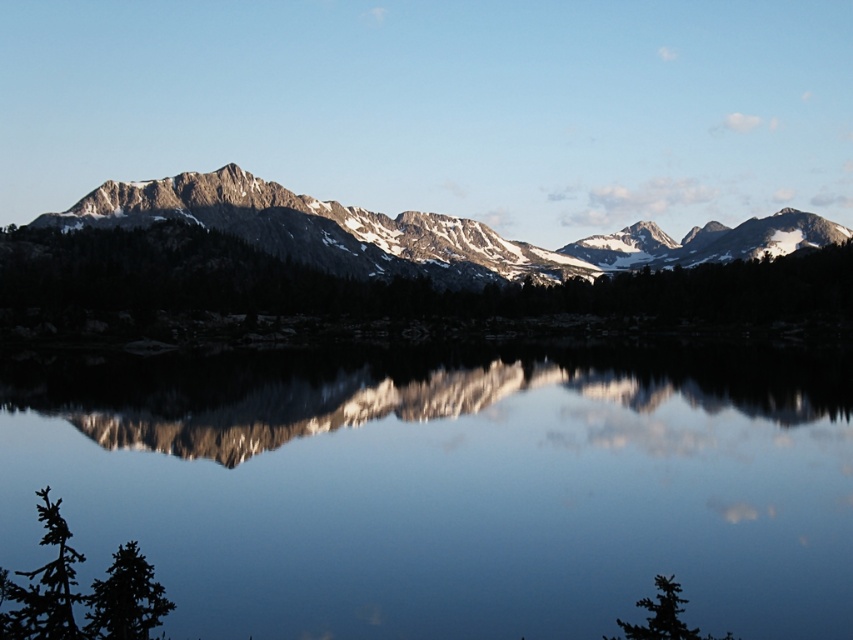
Question: Which point is farther to the camera?

Choices:
 (A) (508, 481)
 (B) (529, 260)

Answer: (B)

Question: Is clear glass water at center positioned before snowy granite mountain range at center?

Choices:
 (A) no
 (B) yes

Answer: (B)

Question: Can you confirm if clear glass water at center is wider than snowy granite mountain range at center?

Choices:
 (A) no
 (B) yes

Answer: (A)

Question: Does clear glass water at center have a lesser width compared to snowy granite mountain range at center?

Choices:
 (A) yes
 (B) no

Answer: (A)

Question: Which of the following is the farthest from the observer?

Choices:
 (A) clear glass water at center
 (B) snowy granite mountain range at center

Answer: (B)

Question: Which object is farther from the camera taking this photo?

Choices:
 (A) clear glass water at center
 (B) snowy granite mountain range at center

Answer: (B)